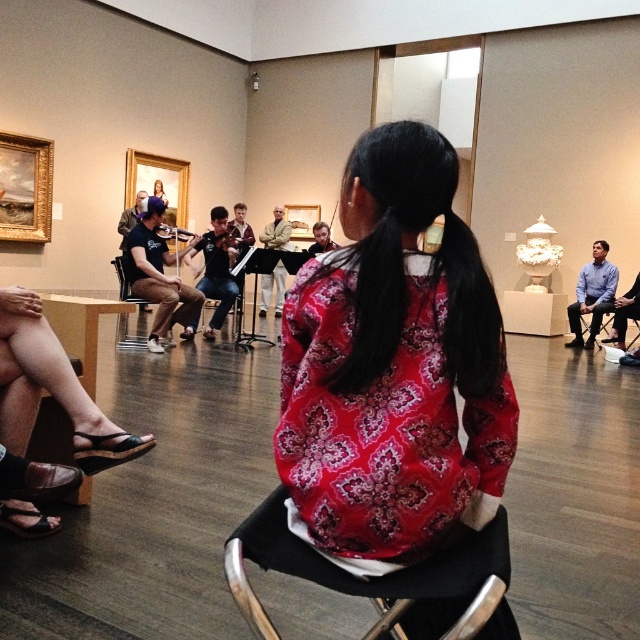
You are standing in the art gallery and want to move from your current position to the blue shirt at right. There is a black fabric chair at center in your path. Can you walk around it without stepping over it?

The black fabric chair at center is closer to you than the blue shirt at right, so you can walk around it to reach the blue shirt at right.

You are standing at the entrance of the art gallery and see two points marked in the midground. The first point is at coordinate (470, 234) and the second is at (506, 538). Which point is closer to you?

Point (470, 234) is closer to you because it is further to the camera than point (506, 538).